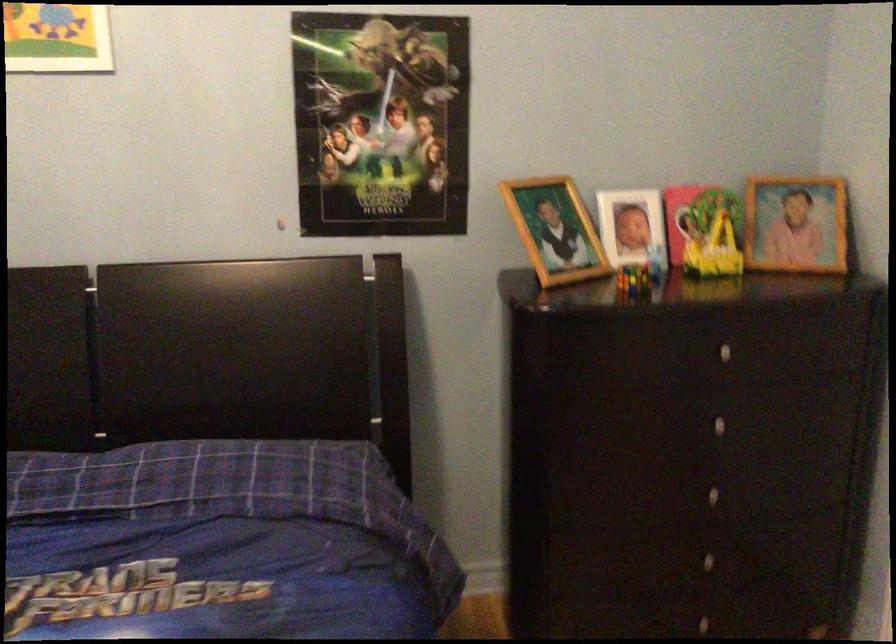
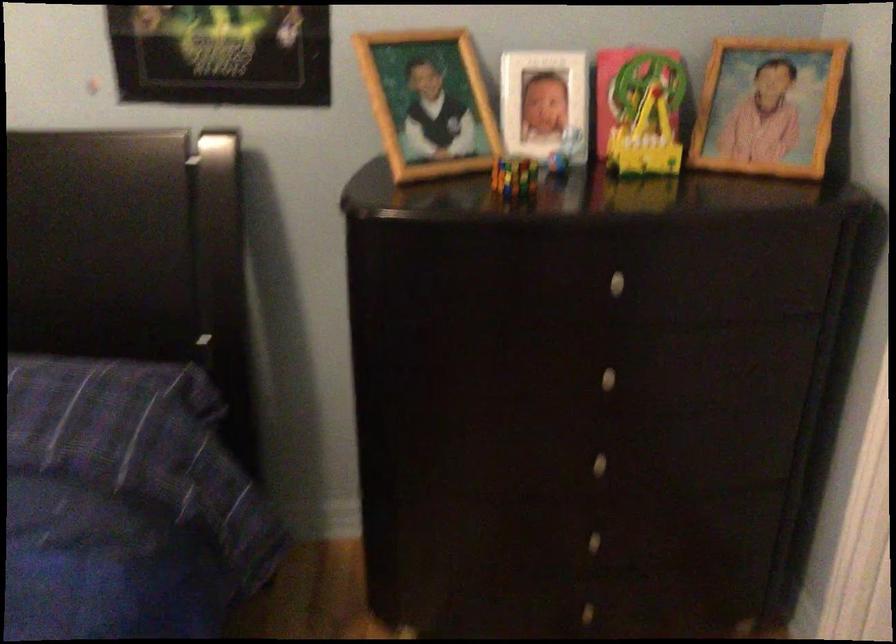
Question: How did the camera likely rotate?

Choices:
 (A) Left
 (B) Right
 (C) Up
 (D) Down

Answer: (D)